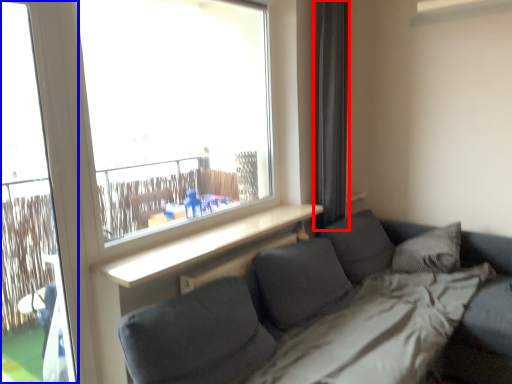
Question: Which object appears farthest to the camera in this image, curtain (highlighted by a red box) or screen door (highlighted by a blue box)?

Choices:
 (A) curtain
 (B) screen door

Answer: (A)